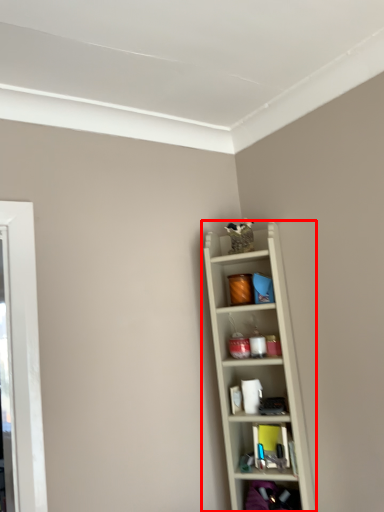
Question: In this image, where is shelf (annotated by the red box) located relative to shelf?

Choices:
 (A) left
 (B) right

Answer: (A)